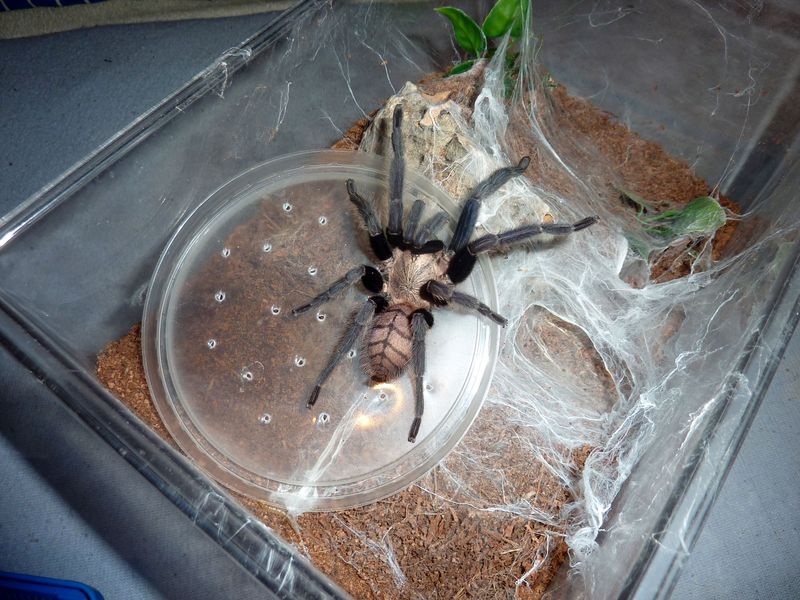
Image resolution: width=800 pixels, height=600 pixels. Identify the location of plant leaves. (465, 40), (489, 28), (517, 29), (694, 213), (630, 203), (648, 236).